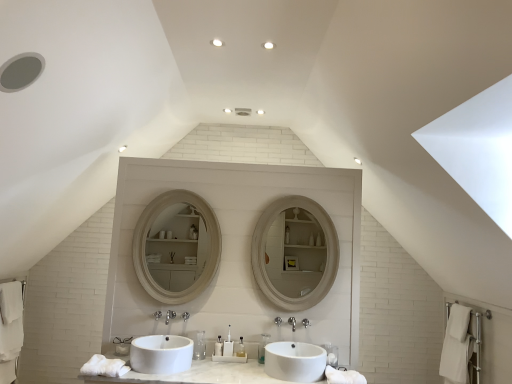
Where is `free location above matte white mirror at center (from a real-world perspective)`? This screenshot has width=512, height=384. free location above matte white mirror at center (from a real-world perspective) is located at coordinates (301, 193).